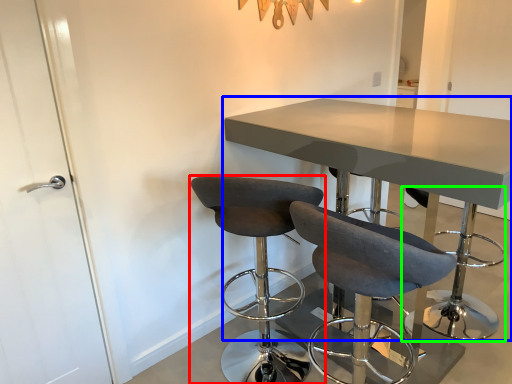
Question: Which object is the closest to the chair (highlighted by a red box)? Choose among these: table (highlighted by a blue box) or bar stool (highlighted by a green box).

Choices:
 (A) table
 (B) bar stool

Answer: (A)